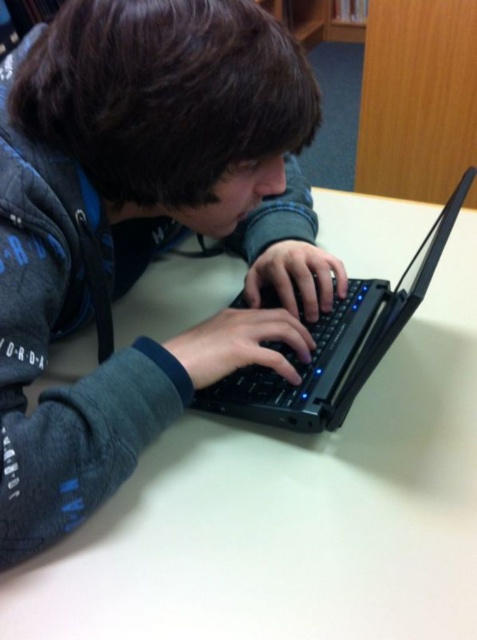
Question: Does white matte table at center have a greater width compared to black plastic laptop at center?

Choices:
 (A) yes
 (B) no

Answer: (A)

Question: Can you confirm if white matte table at center is positioned below black plastic laptop at center?

Choices:
 (A) no
 (B) yes

Answer: (B)

Question: Observing the image, what is the correct spatial positioning of white matte table at center in reference to black plastic laptop at center?

Choices:
 (A) above
 (B) below

Answer: (B)

Question: Which point is closer to the camera?

Choices:
 (A) (x=250, y=392)
 (B) (x=365, y=602)

Answer: (B)